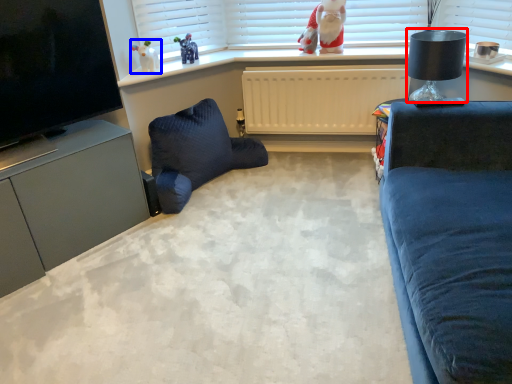
Question: Which of the following is the farthest to the observer, lamp (highlighted by a red box) or toy (highlighted by a blue box)?

Choices:
 (A) lamp
 (B) toy

Answer: (B)